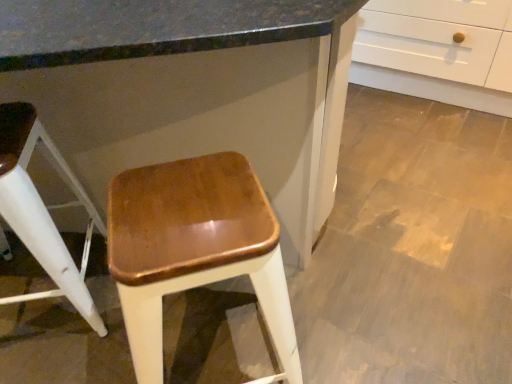
The width and height of the screenshot is (512, 384). Find the location of `glossy wood stool at center, positioned as the 2th stool in left-to-right order`. glossy wood stool at center, positioned as the 2th stool in left-to-right order is located at coordinates (194, 249).

Find the location of a particular element. white glossy cabinet at upper right is located at coordinates (191, 89).

Is there a large distance between shiny brown wood stool at center, placed as the 2th stool when sorted from right to left, and white glossy cabinet at upper right?

That's not correct — shiny brown wood stool at center, placed as the 2th stool when sorted from right to left, is a little close to white glossy cabinet at upper right.

Considering the points (8, 154) and (35, 179), which point is in front, point (8, 154) or point (35, 179)?

The point (8, 154) is closer.

From the image's perspective, is shiny brown wood stool at center, acting as the 1th stool starting from the left, positioned above or below white glossy cabinet at upper right?

From the image's perspective, shiny brown wood stool at center, acting as the 1th stool starting from the left, appears below white glossy cabinet at upper right.

Is shiny brown wood stool at center, acting as the 1th stool starting from the left, to the right of white glossy cabinet at upper right from the viewer's perspective?

Yes, shiny brown wood stool at center, acting as the 1th stool starting from the left, is to the right of white glossy cabinet at upper right.

Could you measure the distance between white glossy cabinet at upper right and shiny brown wood stool at center, placed as the 2th stool when sorted from right to left?

white glossy cabinet at upper right and shiny brown wood stool at center, placed as the 2th stool when sorted from right to left, are 39.99 centimeters apart from each other.

Considering the sizes of objects white glossy cabinet at upper right and shiny brown wood stool at center, acting as the 1th stool starting from the left, in the image provided, who is smaller, white glossy cabinet at upper right or shiny brown wood stool at center, acting as the 1th stool starting from the left,?

shiny brown wood stool at center, acting as the 1th stool starting from the left.

Between white glossy cabinet at upper right and shiny brown wood stool at center, acting as the 1th stool starting from the left, which one has more height?

Standing taller between the two is white glossy cabinet at upper right.

Does white glossy cabinet at upper right have a greater width compared to shiny brown wood stool at center, placed as the 2th stool when sorted from right to left?

Correct, the width of white glossy cabinet at upper right exceeds that of shiny brown wood stool at center, placed as the 2th stool when sorted from right to left.

Which point is more distant from viewer, (64, 270) or (130, 341)?

The point (64, 270) is more distant.

Considering the relative sizes of shiny brown wood stool at center, placed as the 2th stool when sorted from right to left, and glossy wood stool at center, which ranks as the 1th stool in right-to-left order, in the image provided, is shiny brown wood stool at center, placed as the 2th stool when sorted from right to left, bigger than glossy wood stool at center, which ranks as the 1th stool in right-to-left order,?

Correct, shiny brown wood stool at center, placed as the 2th stool when sorted from right to left, is larger in size than glossy wood stool at center, which ranks as the 1th stool in right-to-left order.

Do you think shiny brown wood stool at center, acting as the 1th stool starting from the left, is within glossy wood stool at center, positioned as the 2th stool in left-to-right order, or outside of it?

shiny brown wood stool at center, acting as the 1th stool starting from the left, cannot be found inside glossy wood stool at center, positioned as the 2th stool in left-to-right order.

The width and height of the screenshot is (512, 384). I want to click on stool above the glossy wood stool at center, positioned as the 2th stool in left-to-right order (from the image's perspective), so click(42, 210).

Does white glossy cabinet at upper right turn towards glossy wood stool at center, which ranks as the 1th stool in right-to-left order?

No, white glossy cabinet at upper right does not turn towards glossy wood stool at center, which ranks as the 1th stool in right-to-left order.

Does white glossy cabinet at upper right have a lesser height compared to glossy wood stool at center, which ranks as the 1th stool in right-to-left order?

Incorrect, the height of white glossy cabinet at upper right does not fall short of that of glossy wood stool at center, which ranks as the 1th stool in right-to-left order.

From a real-world perspective, is white glossy cabinet at upper right under glossy wood stool at center, positioned as the 2th stool in left-to-right order?

Actually, white glossy cabinet at upper right is physically above glossy wood stool at center, positioned as the 2th stool in left-to-right order, in the real world.

How different are the orientations of white glossy cabinet at upper right and glossy wood stool at center, which ranks as the 1th stool in right-to-left order, in degrees?

44.7 degrees separate the facing orientations of white glossy cabinet at upper right and glossy wood stool at center, which ranks as the 1th stool in right-to-left order.

Considering the relative positions of glossy wood stool at center, which ranks as the 1th stool in right-to-left order, and white glossy cabinet at upper right in the image provided, is glossy wood stool at center, which ranks as the 1th stool in right-to-left order, to the left of white glossy cabinet at upper right from the viewer's perspective?

In fact, glossy wood stool at center, which ranks as the 1th stool in right-to-left order, is to the right of white glossy cabinet at upper right.

Is white glossy cabinet at upper right completely or partially inside glossy wood stool at center, which ranks as the 1th stool in right-to-left order?

No, white glossy cabinet at upper right is located outside of glossy wood stool at center, which ranks as the 1th stool in right-to-left order.

Starting from the white glossy cabinet at upper right, which stool is the 1st one behind? Please provide its 2D coordinates.

[(194, 249)]

From a real-world perspective, is glossy wood stool at center, positioned as the 2th stool in left-to-right order, under white glossy cabinet at upper right?

Yes, from a real-world perspective, glossy wood stool at center, positioned as the 2th stool in left-to-right order, is below white glossy cabinet at upper right.

Does glossy wood stool at center, which ranks as the 1th stool in right-to-left order, have a greater width compared to shiny brown wood stool at center, placed as the 2th stool when sorted from right to left?

Incorrect, the width of glossy wood stool at center, which ranks as the 1th stool in right-to-left order, does not surpass that of shiny brown wood stool at center, placed as the 2th stool when sorted from right to left.

From the image's perspective, which is above, glossy wood stool at center, which ranks as the 1th stool in right-to-left order, or shiny brown wood stool at center, placed as the 2th stool when sorted from right to left?

shiny brown wood stool at center, placed as the 2th stool when sorted from right to left, appears higher in the image.

Is glossy wood stool at center, which ranks as the 1th stool in right-to-left order, beside shiny brown wood stool at center, placed as the 2th stool when sorted from right to left?

No, glossy wood stool at center, which ranks as the 1th stool in right-to-left order, is not next to shiny brown wood stool at center, placed as the 2th stool when sorted from right to left.

Is glossy wood stool at center, which ranks as the 1th stool in right-to-left order, spatially inside shiny brown wood stool at center, placed as the 2th stool when sorted from right to left, or outside of it?

glossy wood stool at center, which ranks as the 1th stool in right-to-left order, is located beyond the bounds of shiny brown wood stool at center, placed as the 2th stool when sorted from right to left.

The image size is (512, 384). I want to click on cabinetry that is above the shiny brown wood stool at center, acting as the 1th stool starting from the left (from a real-world perspective), so click(x=191, y=89).

From a real-world perspective, count 2nd stools downward from the white glossy cabinet at upper right and point to it. Please provide its 2D coordinates.

[(42, 210)]

Considering their positions, is shiny brown wood stool at center, placed as the 2th stool when sorted from right to left, positioned closer to glossy wood stool at center, positioned as the 2th stool in left-to-right order, than white glossy cabinet at upper right?

white glossy cabinet at upper right is positioned closer to the anchor glossy wood stool at center, positioned as the 2th stool in left-to-right order.

Considering their positions, is glossy wood stool at center, which ranks as the 1th stool in right-to-left order, positioned closer to shiny brown wood stool at center, acting as the 1th stool starting from the left, than white glossy cabinet at upper right?

white glossy cabinet at upper right is closer to shiny brown wood stool at center, acting as the 1th stool starting from the left.

When comparing their distances from shiny brown wood stool at center, acting as the 1th stool starting from the left, does white glossy cabinet at upper right or glossy wood stool at center, which ranks as the 1th stool in right-to-left order, seem closer?

Based on the image, white glossy cabinet at upper right appears to be nearer to shiny brown wood stool at center, acting as the 1th stool starting from the left.

Considering their positions, is glossy wood stool at center, positioned as the 2th stool in left-to-right order, positioned further to white glossy cabinet at upper right than shiny brown wood stool at center, acting as the 1th stool starting from the left?

shiny brown wood stool at center, acting as the 1th stool starting from the left, is further to white glossy cabinet at upper right.

From the image, which object appears to be nearer to glossy wood stool at center, positioned as the 2th stool in left-to-right order, white glossy cabinet at upper right or shiny brown wood stool at center, placed as the 2th stool when sorted from right to left?

The object closer to glossy wood stool at center, positioned as the 2th stool in left-to-right order, is white glossy cabinet at upper right.

Considering their positions, is shiny brown wood stool at center, acting as the 1th stool starting from the left, positioned further to white glossy cabinet at upper right than glossy wood stool at center, positioned as the 2th stool in left-to-right order?

shiny brown wood stool at center, acting as the 1th stool starting from the left.

Where is `stool situated between white glossy cabinet at upper right and glossy wood stool at center, which ranks as the 1th stool in right-to-left order, from left to right`? This screenshot has height=384, width=512. stool situated between white glossy cabinet at upper right and glossy wood stool at center, which ranks as the 1th stool in right-to-left order, from left to right is located at coordinates (42, 210).